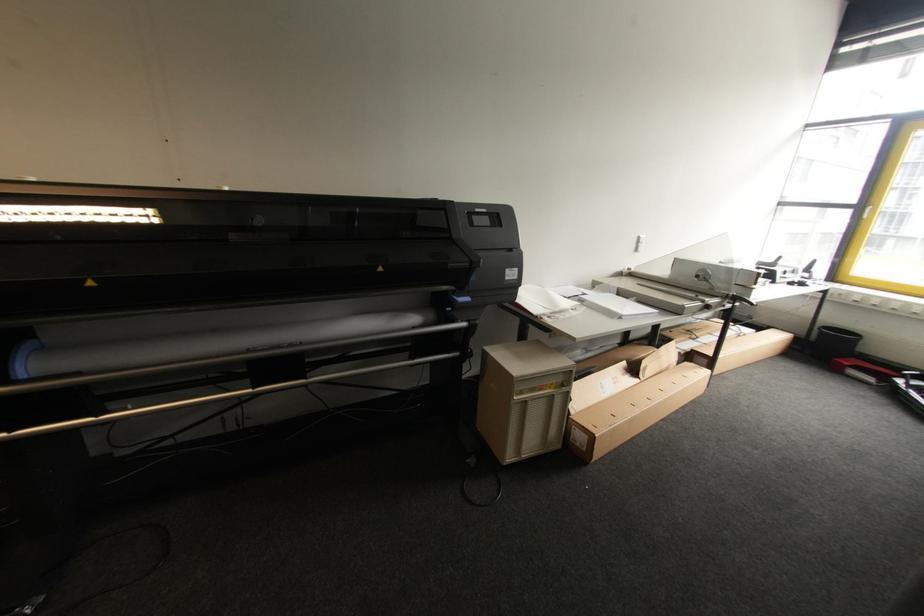
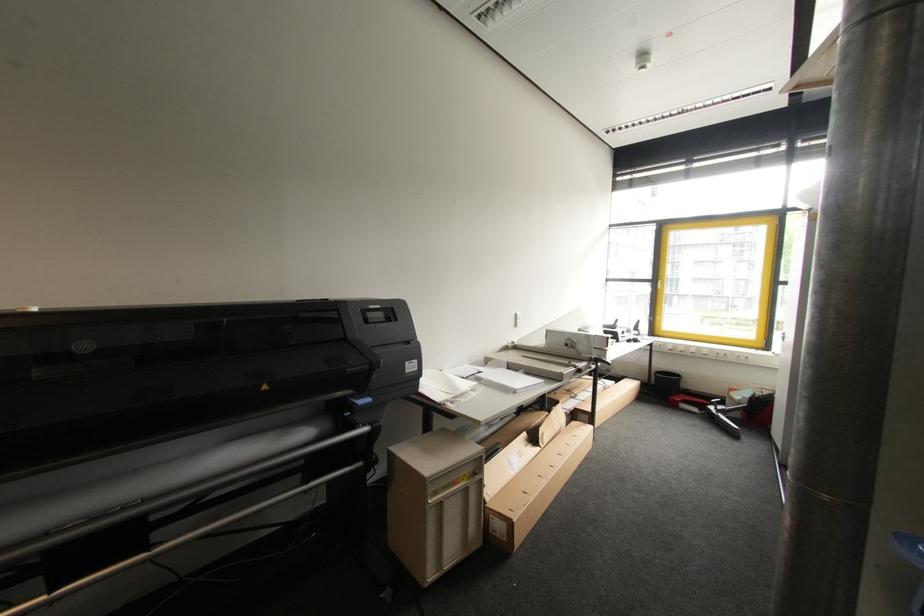
Locate, in the second image, the point that corresponds to (868,206) in the first image.

(660, 281)